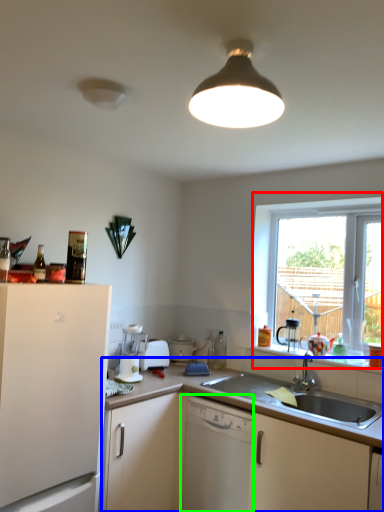
Question: Based on their relative distances, which object is farther from window (highlighted by a red box)? Choose from cabinetry (highlighted by a blue box) and dishwasher (highlighted by a green box).

Choices:
 (A) cabinetry
 (B) dishwasher

Answer: (B)